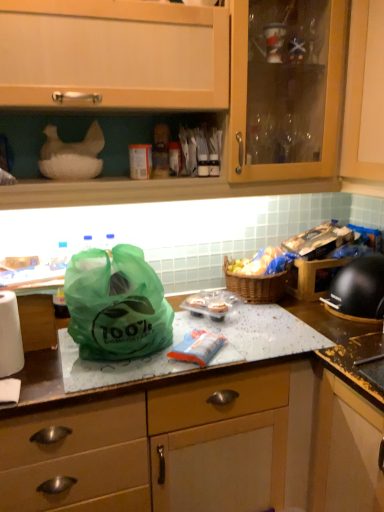
Question: Is wooden cabinet at upper center at the right side of green plastic bag at center?

Choices:
 (A) yes
 (B) no

Answer: (A)

Question: From the image's perspective, would you say wooden cabinet at upper center is shown under green plastic bag at center?

Choices:
 (A) no
 (B) yes

Answer: (A)

Question: Is wooden cabinet at upper center smaller than green plastic bag at center?

Choices:
 (A) yes
 (B) no

Answer: (B)

Question: From the image's perspective, is wooden cabinet at upper center above green plastic bag at center?

Choices:
 (A) yes
 (B) no

Answer: (A)

Question: Can you confirm if wooden cabinet at upper center is thinner than green plastic bag at center?

Choices:
 (A) no
 (B) yes

Answer: (A)

Question: Relative to black plastic helmet at right, is green plastic bag at center in front or behind?

Choices:
 (A) front
 (B) behind

Answer: (A)

Question: Considering the positions of point click(x=89, y=295) and point click(x=360, y=261), is point click(x=89, y=295) closer or farther from the camera than point click(x=360, y=261)?

Choices:
 (A) farther
 (B) closer

Answer: (B)

Question: In terms of height, does green plastic bag at center look taller or shorter compared to black plastic helmet at right?

Choices:
 (A) tall
 (B) short

Answer: (A)

Question: Based on their sizes in the image, would you say green plastic bag at center is bigger or smaller than black plastic helmet at right?

Choices:
 (A) small
 (B) big

Answer: (B)

Question: Looking at their shapes, would you say black plastic helmet at right is wider or thinner than wooden cabinet at upper center?

Choices:
 (A) wide
 (B) thin

Answer: (B)

Question: Relative to wooden cabinet at upper center, is black plastic helmet at right in front or behind?

Choices:
 (A) behind
 (B) front

Answer: (A)

Question: Is black plastic helmet at right taller or shorter than wooden cabinet at upper center?

Choices:
 (A) tall
 (B) short

Answer: (B)

Question: Considering the positions of point [372, 261] and point [84, 27], is point [372, 261] closer or farther from the camera than point [84, 27]?

Choices:
 (A) farther
 (B) closer

Answer: (A)

Question: Visually, is woven brown picnic basket at center positioned to the left or to the right of wooden cabinet at upper center?

Choices:
 (A) left
 (B) right

Answer: (B)

Question: Is woven brown picnic basket at center taller or shorter than wooden cabinet at upper center?

Choices:
 (A) tall
 (B) short

Answer: (B)